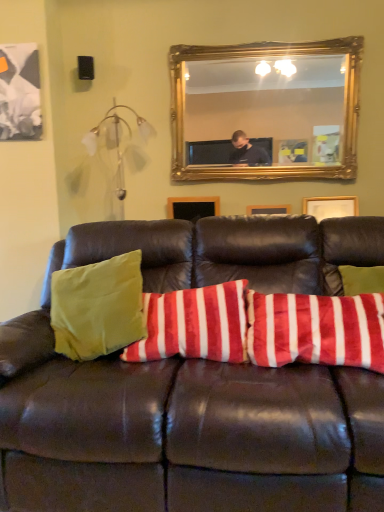
Question: In terms of height, does leather couch at center look taller or shorter compared to gold-framed mirror at upper center?

Choices:
 (A) short
 (B) tall

Answer: (B)

Question: In the image, is leather couch at center on the left side or the right side of gold-framed mirror at upper center?

Choices:
 (A) left
 (B) right

Answer: (A)

Question: Which of these objects is positioned closest to the gold-framed mirror at upper center?

Choices:
 (A) leather couch at center
 (B) velvety red and white striped pillow at center

Answer: (B)

Question: Which object is positioned closest to the velvety red and white striped pillow at center?

Choices:
 (A) leather couch at center
 (B) gold-framed mirror at upper center

Answer: (A)